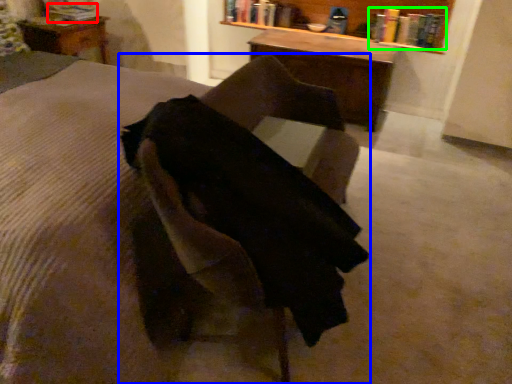
Question: Which is nearer to the book (highlighted by a red box)? chair (highlighted by a blue box) or book (highlighted by a green box).

Choices:
 (A) chair
 (B) book

Answer: (B)